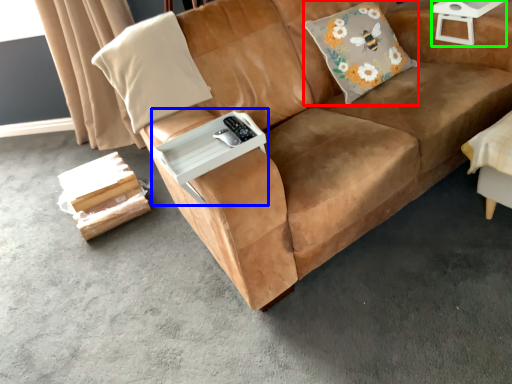
Question: Considering the real-world distances, which object is closest to throw pillow (highlighted by a red box)? table (highlighted by a blue box) or side table (highlighted by a green box).

Choices:
 (A) table
 (B) side table

Answer: (B)